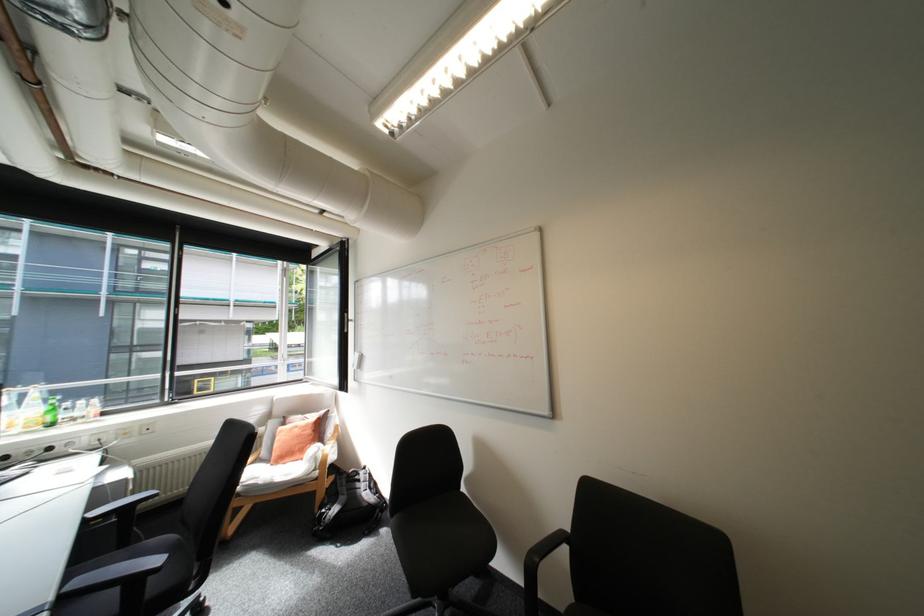
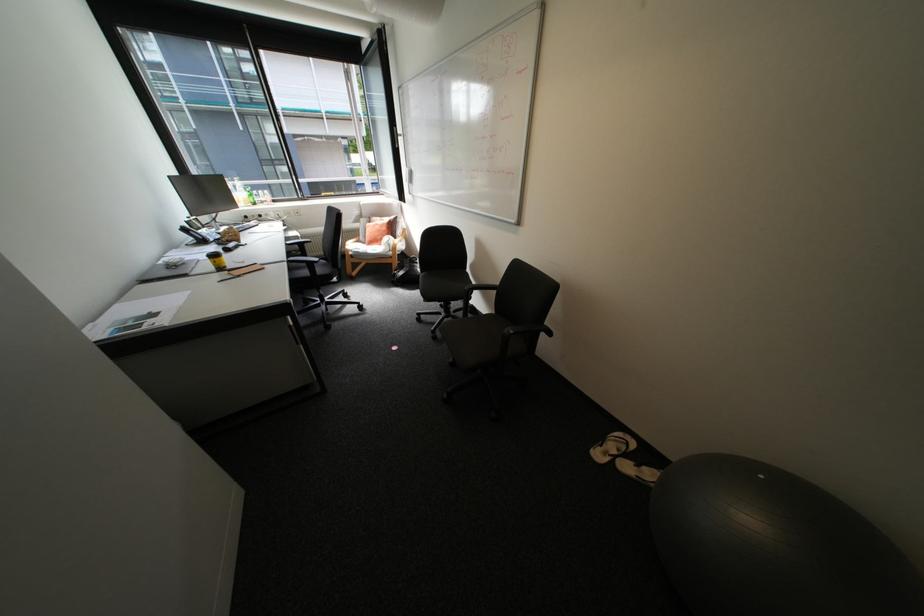
Find the pixel in the second image that matches [326,450] in the first image.

(397, 238)